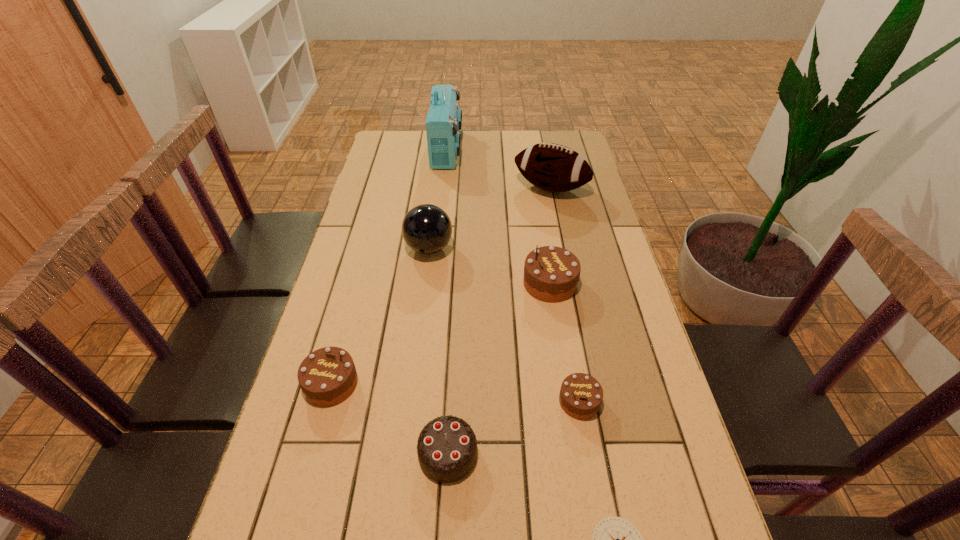
This screenshot has height=540, width=960. I want to click on vacant area that lies between the farthest object and the second farthest object, so click(498, 169).

Identify which object is located as the seventh nearest to the leftmost brown chocolate cake. Please provide its 2D coordinates. Your answer should be formatted as a tuple, i.e. [(x, y)], where the tuple contains the x and y coordinates of a point satisfying the conditions above.

[(443, 122)]

Identify which object is the second nearest to the sixth shortest object. Please provide its 2D coordinates. Your answer should be formatted as a tuple, i.e. [(x, y)], where the tuple contains the x and y coordinates of a point satisfying the conditions above.

[(552, 167)]

I want to click on chocolate cake that stands as the closest to the tallest object, so click(551, 274).

Identify the location of chocolate cake identified as the second closest to the shortest object. This screenshot has height=540, width=960. (447, 447).

Choose which brown chocolate cake is the second nearest neighbor to the smallest brown chocolate cake. Please provide its 2D coordinates. Your answer should be formatted as a tuple, i.e. [(x, y)], where the tuple contains the x and y coordinates of a point satisfying the conditions above.

[(327, 376)]

Where is `the second closest brown chocolate cake to the compass`? Image resolution: width=960 pixels, height=540 pixels. the second closest brown chocolate cake to the compass is located at coordinates (551, 274).

Identify the location of vacant space that satisfies the following two spatial constraints: 1. on the side of the black bowling ball with the finger holes; 2. on the left side of the smallest brown chocolate cake. The width and height of the screenshot is (960, 540). (410, 401).

The width and height of the screenshot is (960, 540). I want to click on free space that satisfies the following two spatial constraints: 1. on the front-facing side of the tallest object; 2. on the left side of the smallest brown chocolate cake, so click(420, 401).

Image resolution: width=960 pixels, height=540 pixels. In order to click on vacant region that satisfies the following two spatial constraints: 1. on the front-facing side of the radio receiver; 2. on the left side of the farthest brown chocolate cake in this screenshot , I will do `click(433, 284)`.